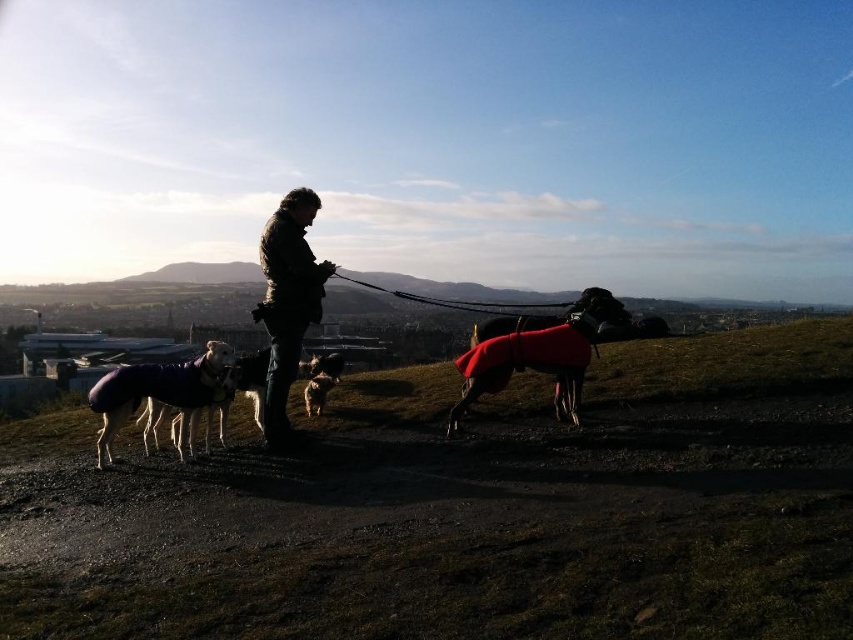
You are a photographer trying to capture the purple fleece coat at lower left in your shot. Based on its 2D coordinates, where should you position your camera relative to the scene?

The purple fleece coat at lower left is located at point 2D coordinates 0.594 on the x axis and 0.293 on the y axis. To capture it in your shot, position your camera so that the coat is centered at those coordinates.

You are standing at the base of the grassy hill in the image. You see two points marked on the hillside. One is at coordinates point (177, 625) and the other is at point (277, 250). Which point is closer to you?

Point (177, 625) is closer to the viewer than point (277, 250).

You are trying to locate the purple fleece coat at lower left and the shiny black dog at center in the scene. Based on their positions, which object is closer to the left edge of the image?

The purple fleece coat at lower left is closer to the left edge of the image because it is positioned to the left of the shiny black dog at center.